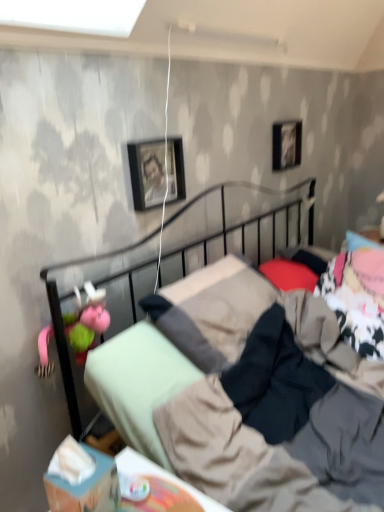
Question: From a real-world perspective, is metallic black bed at center physically below pink fabric doll at left?

Choices:
 (A) yes
 (B) no

Answer: (A)

Question: Can you confirm if metallic black bed at center is wider than pink fabric doll at left?

Choices:
 (A) no
 (B) yes

Answer: (B)

Question: From a real-world perspective, does metallic black bed at center stand above pink fabric doll at left?

Choices:
 (A) no
 (B) yes

Answer: (A)

Question: From the image's perspective, does metallic black bed at center appear higher than pink fabric doll at left?

Choices:
 (A) yes
 (B) no

Answer: (A)

Question: Is metallic black bed at center next to pink fabric doll at left?

Choices:
 (A) yes
 (B) no

Answer: (B)

Question: Do you think pink fabric doll at left is within metallic black bed at center, or outside of it?

Choices:
 (A) inside
 (B) outside

Answer: (A)

Question: From their relative heights in the image, would you say pink fabric doll at left is taller or shorter than metallic black bed at center?

Choices:
 (A) tall
 (B) short

Answer: (B)

Question: Visually, is pink fabric doll at left positioned to the left or to the right of metallic black bed at center?

Choices:
 (A) left
 (B) right

Answer: (A)

Question: Considering the positions of pink fabric doll at left and metallic black bed at center in the image, is pink fabric doll at left wider or thinner than metallic black bed at center?

Choices:
 (A) wide
 (B) thin

Answer: (B)

Question: Considering the positions of black glossy picture frame at upper right, the 1th picture frame from the top, and blue cardboard box at lower left in the image, is black glossy picture frame at upper right, the 1th picture frame from the top, taller or shorter than blue cardboard box at lower left?

Choices:
 (A) short
 (B) tall

Answer: (B)

Question: Would you say black glossy picture frame at upper right, which is the 2th picture frame in bottom-to-top order, is inside or outside blue cardboard box at lower left?

Choices:
 (A) inside
 (B) outside

Answer: (B)

Question: Is black glossy picture frame at upper right, the 1th picture frame from the top, wider or thinner than blue cardboard box at lower left?

Choices:
 (A) wide
 (B) thin

Answer: (B)

Question: From the image's perspective, is black glossy picture frame at upper right, which is the 2th picture frame in bottom-to-top order, positioned above or below blue cardboard box at lower left?

Choices:
 (A) above
 (B) below

Answer: (A)

Question: Relative to pink fabric pillow at upper right, the 1th pillow from the back, is black matte picture frame at upper center, which is the second picture frame in right-to-left order, in front or behind?

Choices:
 (A) behind
 (B) front

Answer: (B)

Question: Looking at the image, does black matte picture frame at upper center, acting as the 1th picture frame starting from the front, seem bigger or smaller compared to pink fabric pillow at upper right, the 1th pillow from the back?

Choices:
 (A) big
 (B) small

Answer: (A)